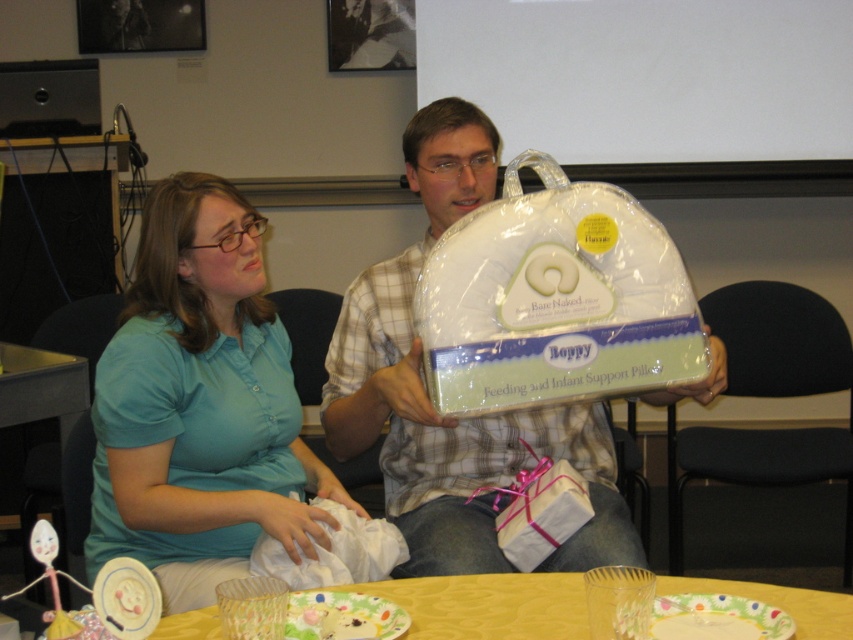
Question: Is matte white pillow at center positioned before white fabric pillow at center?

Choices:
 (A) no
 (B) yes

Answer: (A)

Question: Is matte white pillow at center to the right of yellow fabric table at lower center from the viewer's perspective?

Choices:
 (A) yes
 (B) no

Answer: (B)

Question: Observing the image, what is the correct spatial positioning of white fabric pillow at center in reference to yellow fabric table at lower center?

Choices:
 (A) below
 (B) above

Answer: (B)

Question: Which point is farther to the camera?

Choices:
 (A) (430, 612)
 (B) (422, 484)
 (C) (428, 346)
 (D) (136, 358)

Answer: (B)

Question: Which object is positioned farthest from the yellow fabric table at lower center?

Choices:
 (A) white fabric pillow at center
 (B) teal fabric shirt at center

Answer: (B)

Question: Considering the real-world distances, which object is farthest from the white fabric pillow at center?

Choices:
 (A) matte white pillow at center
 (B) teal fabric shirt at center

Answer: (B)